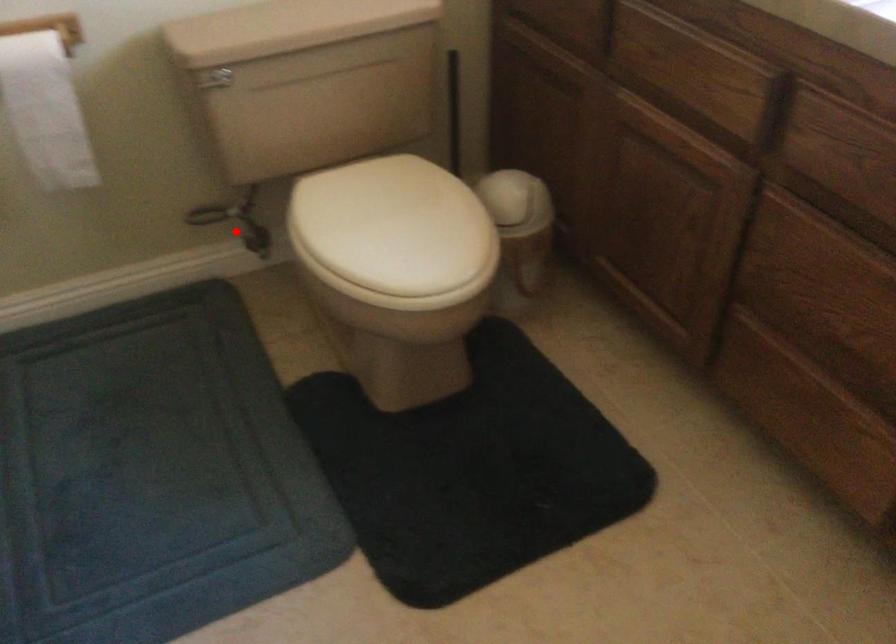
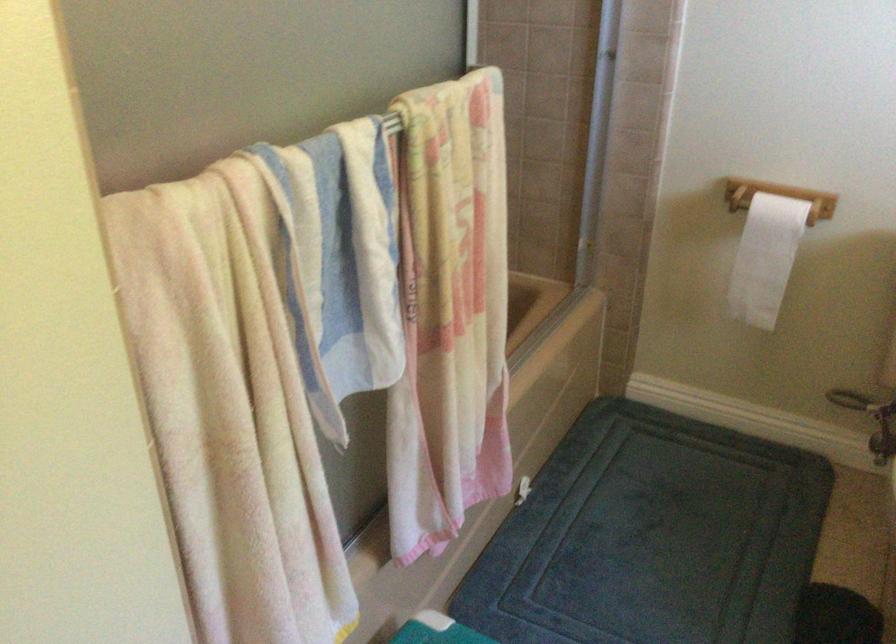
In the second image, find the point that corresponds to the highlighted location in the first image.

(871, 420)